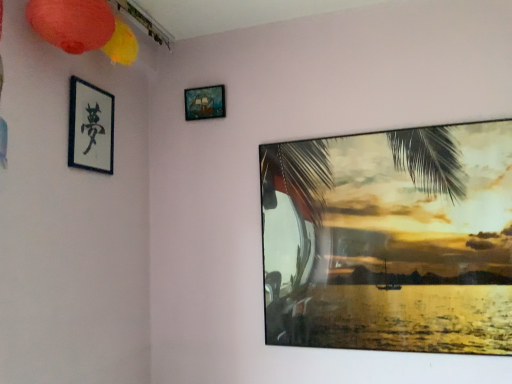
What is the approximate height of metallic glossy picture frame at upper right, placed as the 1th picture frame when sorted from right to left?

The height of metallic glossy picture frame at upper right, placed as the 1th picture frame when sorted from right to left, is 31.71 inches.

What is the approximate width of metallic glossy picture frame at upper right, the third picture frame when ordered from left to right?

1.20 inches.

What is the approximate height of matte paper lantern at upper left?

It is 8.34 inches.

What do you see at coordinates (204, 102) in the screenshot?
I see `wooden ship painting at upper center, the 2th picture frame from the right` at bounding box center [204, 102].

Image resolution: width=512 pixels, height=384 pixels. Find the location of `metallic glossy picture frame at upper right, placed as the 1th picture frame when sorted from right to left`. metallic glossy picture frame at upper right, placed as the 1th picture frame when sorted from right to left is located at coordinates (390, 240).

How many degrees apart are the facing directions of matte paper lantern at upper left and metallic glossy picture frame at upper right, placed as the 1th picture frame when sorted from right to left?

85.3 degrees separate the facing orientations of matte paper lantern at upper left and metallic glossy picture frame at upper right, placed as the 1th picture frame when sorted from right to left.

Can you see matte paper lantern at upper left touching metallic glossy picture frame at upper right, the third picture frame when ordered from left to right?

No, matte paper lantern at upper left is not making contact with metallic glossy picture frame at upper right, the third picture frame when ordered from left to right.

Would you say matte paper lantern at upper left is to the left or to the right of metallic glossy picture frame at upper right, placed as the 1th picture frame when sorted from right to left, in the picture?

matte paper lantern at upper left is positioned on metallic glossy picture frame at upper right, placed as the 1th picture frame when sorted from right to left,'s left side.

Is matte paper lantern at upper left turned away from metallic glossy picture frame at upper right, the third picture frame when ordered from left to right?

No, matte paper lantern at upper left's orientation is not away from metallic glossy picture frame at upper right, the third picture frame when ordered from left to right.

Which object is positioned more to the left, matte paper lantern at upper left or black paper at upper left, which ranks as the 3th picture frame in right-to-left order?

From the viewer's perspective, black paper at upper left, which ranks as the 3th picture frame in right-to-left order, appears more on the left side.

Which object is further away from the camera taking this photo, matte paper lantern at upper left or black paper at upper left, the 1th picture frame when ordered from left to right?

black paper at upper left, the 1th picture frame when ordered from left to right, is more distant.

From the image's perspective, between matte paper lantern at upper left and black paper at upper left, the 1th picture frame when ordered from left to right, who is located below?

From the image's view, black paper at upper left, the 1th picture frame when ordered from left to right, is below.

Where is `lantern that appears in front of the black paper at upper left, which ranks as the 3th picture frame in right-to-left order`? The height and width of the screenshot is (384, 512). lantern that appears in front of the black paper at upper left, which ranks as the 3th picture frame in right-to-left order is located at coordinates (72, 23).

From a real-world perspective, who is located lower, wooden ship painting at upper center, the second picture frame when ordered from left to right, or matte paper lantern at upper left?

wooden ship painting at upper center, the second picture frame when ordered from left to right.

Is point (199, 101) closer or farther from the camera than point (105, 1)?

Point (199, 101) is positioned farther from the camera compared to point (105, 1).

Considering the relative sizes of wooden ship painting at upper center, the second picture frame when ordered from left to right, and matte paper lantern at upper left in the image provided, is wooden ship painting at upper center, the second picture frame when ordered from left to right, bigger than matte paper lantern at upper left?

Actually, wooden ship painting at upper center, the second picture frame when ordered from left to right, might be smaller than matte paper lantern at upper left.

Is black paper at upper left, which ranks as the 3th picture frame in right-to-left order, to the left of wooden ship painting at upper center, the second picture frame when ordered from left to right, from the viewer's perspective?

Yes, black paper at upper left, which ranks as the 3th picture frame in right-to-left order, is to the left of wooden ship painting at upper center, the second picture frame when ordered from left to right.

This screenshot has width=512, height=384. I want to click on the 1st picture frame to the right when counting from the black paper at upper left, the 1th picture frame when ordered from left to right, so click(204, 102).

Is black paper at upper left, which ranks as the 3th picture frame in right-to-left order, far from wooden ship painting at upper center, the second picture frame when ordered from left to right?

No, black paper at upper left, which ranks as the 3th picture frame in right-to-left order, is in close proximity to wooden ship painting at upper center, the second picture frame when ordered from left to right.

Would you say wooden ship painting at upper center, the 2th picture frame from the right, is outside black paper at upper left, the 1th picture frame when ordered from left to right?

Yes.

Which object is more forward, wooden ship painting at upper center, the second picture frame when ordered from left to right, or black paper at upper left, which ranks as the 3th picture frame in right-to-left order?

black paper at upper left, which ranks as the 3th picture frame in right-to-left order, is closer to the camera.

Is wooden ship painting at upper center, the 2th picture frame from the right, placed right next to black paper at upper left, which ranks as the 3th picture frame in right-to-left order?

There is a gap between wooden ship painting at upper center, the 2th picture frame from the right, and black paper at upper left, which ranks as the 3th picture frame in right-to-left order.

Is wooden ship painting at upper center, the second picture frame when ordered from left to right, at the right side of black paper at upper left, which ranks as the 3th picture frame in right-to-left order?

Indeed, wooden ship painting at upper center, the second picture frame when ordered from left to right, is positioned on the right side of black paper at upper left, which ranks as the 3th picture frame in right-to-left order.

From a real-world perspective, who is located lower, metallic glossy picture frame at upper right, the third picture frame when ordered from left to right, or black paper at upper left, the 1th picture frame when ordered from left to right?

From a 3D spatial view, metallic glossy picture frame at upper right, the third picture frame when ordered from left to right, is below.

From the image's perspective, would you say metallic glossy picture frame at upper right, the third picture frame when ordered from left to right, is shown under black paper at upper left, the 1th picture frame when ordered from left to right?

Yes.

Which of these two, metallic glossy picture frame at upper right, placed as the 1th picture frame when sorted from right to left, or black paper at upper left, which ranks as the 3th picture frame in right-to-left order, stands shorter?

black paper at upper left, which ranks as the 3th picture frame in right-to-left order.

Is metallic glossy picture frame at upper right, placed as the 1th picture frame when sorted from right to left, at the left side of black paper at upper left, which ranks as the 3th picture frame in right-to-left order?

No, metallic glossy picture frame at upper right, placed as the 1th picture frame when sorted from right to left, is not to the left of black paper at upper left, which ranks as the 3th picture frame in right-to-left order.

From the image's perspective, is black paper at upper left, the 1th picture frame when ordered from left to right, below matte paper lantern at upper left?

Yes, from the image's perspective, black paper at upper left, the 1th picture frame when ordered from left to right, is beneath matte paper lantern at upper left.

Measure the distance between black paper at upper left, which ranks as the 3th picture frame in right-to-left order, and matte paper lantern at upper left.

black paper at upper left, which ranks as the 3th picture frame in right-to-left order, and matte paper lantern at upper left are 10.32 inches apart from each other.

Locate an element on the screen. The height and width of the screenshot is (384, 512). lantern that is above the black paper at upper left, which ranks as the 3th picture frame in right-to-left order (from the image's perspective) is located at coordinates (72, 23).

Find the location of a particular element. lantern to the left of metallic glossy picture frame at upper right, placed as the 1th picture frame when sorted from right to left is located at coordinates 72,23.

Where is `lantern located on the right of black paper at upper left, which ranks as the 3th picture frame in right-to-left order`? Image resolution: width=512 pixels, height=384 pixels. lantern located on the right of black paper at upper left, which ranks as the 3th picture frame in right-to-left order is located at coordinates (72, 23).

Which object lies nearer to the anchor point matte paper lantern at upper left, black paper at upper left, which ranks as the 3th picture frame in right-to-left order, or wooden ship painting at upper center, the 2th picture frame from the right?

black paper at upper left, which ranks as the 3th picture frame in right-to-left order.

Which object lies nearer to the anchor point black paper at upper left, the 1th picture frame when ordered from left to right, wooden ship painting at upper center, the second picture frame when ordered from left to right, or matte paper lantern at upper left?

matte paper lantern at upper left is positioned closer to the anchor black paper at upper left, the 1th picture frame when ordered from left to right.

Based on their spatial positions, is wooden ship painting at upper center, the second picture frame when ordered from left to right, or black paper at upper left, the 1th picture frame when ordered from left to right, closer to matte paper lantern at upper left?

Based on the image, black paper at upper left, the 1th picture frame when ordered from left to right, appears to be nearer to matte paper lantern at upper left.

Estimate the real-world distances between objects in this image. Which object is further from wooden ship painting at upper center, the second picture frame when ordered from left to right, metallic glossy picture frame at upper right, placed as the 1th picture frame when sorted from right to left, or matte paper lantern at upper left?

The object further to wooden ship painting at upper center, the second picture frame when ordered from left to right, is metallic glossy picture frame at upper right, placed as the 1th picture frame when sorted from right to left.

From the image, which object appears to be farther from metallic glossy picture frame at upper right, the third picture frame when ordered from left to right, black paper at upper left, the 1th picture frame when ordered from left to right, or wooden ship painting at upper center, the 2th picture frame from the right?

The object further to metallic glossy picture frame at upper right, the third picture frame when ordered from left to right, is black paper at upper left, the 1th picture frame when ordered from left to right.

Considering their positions, is metallic glossy picture frame at upper right, placed as the 1th picture frame when sorted from right to left, positioned further to wooden ship painting at upper center, the second picture frame when ordered from left to right, than black paper at upper left, the 1th picture frame when ordered from left to right?

Based on the image, metallic glossy picture frame at upper right, placed as the 1th picture frame when sorted from right to left, appears to be further to wooden ship painting at upper center, the second picture frame when ordered from left to right.

Estimate the real-world distances between objects in this image. Which object is closer to black paper at upper left, which ranks as the 3th picture frame in right-to-left order, matte paper lantern at upper left or metallic glossy picture frame at upper right, placed as the 1th picture frame when sorted from right to left?

matte paper lantern at upper left.

When comparing their distances from wooden ship painting at upper center, the second picture frame when ordered from left to right, does matte paper lantern at upper left or metallic glossy picture frame at upper right, the third picture frame when ordered from left to right, seem further?

The object further to wooden ship painting at upper center, the second picture frame when ordered from left to right, is metallic glossy picture frame at upper right, the third picture frame when ordered from left to right.

You are a GUI agent. You are given a task and a screenshot of the screen. Output one action in this format:
    pyautogui.click(x=<x>, y=<y>)
    Task: Click on the picture frame between black paper at upper left, which ranks as the 3th picture frame in right-to-left order, and metallic glossy picture frame at upper right, the third picture frame when ordered from left to right, in the horizontal direction
    
    Given the screenshot: What is the action you would take?
    pyautogui.click(x=204, y=102)

Identify the location of picture frame situated between matte paper lantern at upper left and metallic glossy picture frame at upper right, the third picture frame when ordered from left to right, from left to right. (204, 102).

I want to click on lantern located between black paper at upper left, the 1th picture frame when ordered from left to right, and metallic glossy picture frame at upper right, the third picture frame when ordered from left to right, in the left-right direction, so click(72, 23).